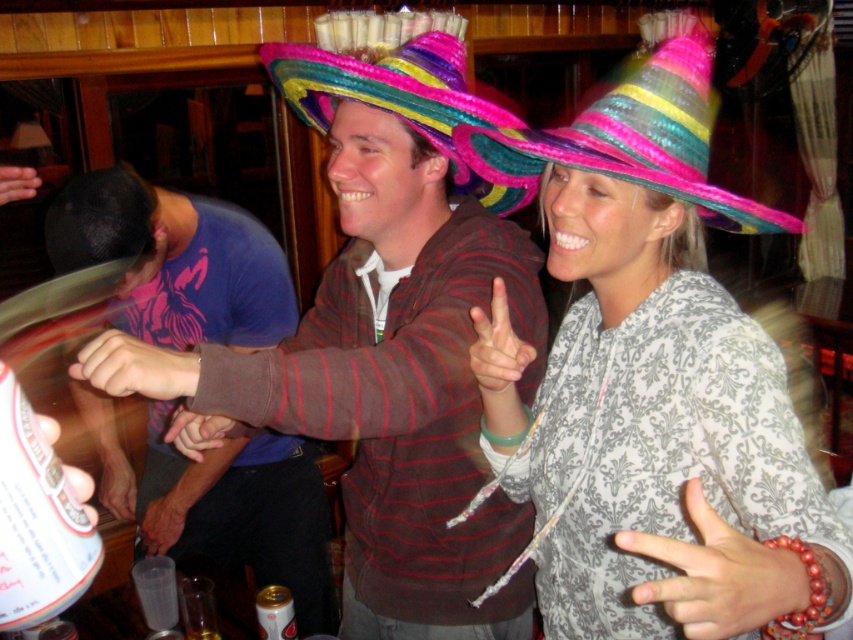
Question: Is blue t-shirt at left thinner than smooth plastic cup at upper left?

Choices:
 (A) yes
 (B) no

Answer: (B)

Question: Which point is closer to the camera?

Choices:
 (A) multicolored paper sombrero at upper right
 (B) patterned fabric jacket at center
 (C) matte brown hand at center

Answer: (B)

Question: In this image, where is patterned fabric jacket at center located relative to smooth skin hand at lower left?

Choices:
 (A) right
 (B) left

Answer: (A)

Question: Which point is farther from the camera taking this photo?

Choices:
 (A) (297, 100)
 (B) (631, 160)
 (C) (142, 540)
 (D) (7, 196)

Answer: (C)

Question: Can you confirm if matte purple fabric at center is positioned to the right of matte pink finger at center?

Choices:
 (A) yes
 (B) no

Answer: (B)

Question: Which point is farther to the camera?

Choices:
 (A) patterned fabric hand at center
 (B) matte purple fabric at center
 (C) patterned fabric jacket at center

Answer: (B)